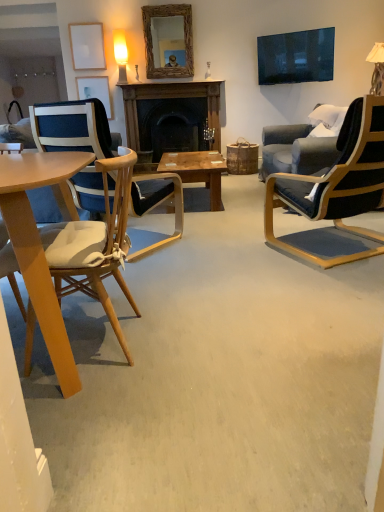
Question: From a real-world perspective, does dark wood fireplace at center stand above black leather chair at right, acting as the third chair starting from the left?

Choices:
 (A) yes
 (B) no

Answer: (A)

Question: From the image's perspective, is dark wood fireplace at center beneath black leather chair at right, marked as the first chair in a right-to-left arrangement?

Choices:
 (A) no
 (B) yes

Answer: (A)

Question: Does dark wood fireplace at center have a lesser height compared to black leather chair at right, acting as the third chair starting from the left?

Choices:
 (A) no
 (B) yes

Answer: (B)

Question: Is dark wood fireplace at center wider than black leather chair at right, marked as the first chair in a right-to-left arrangement?

Choices:
 (A) no
 (B) yes

Answer: (A)

Question: From the image's perspective, would you say dark wood fireplace at center is positioned over black leather chair at right, acting as the third chair starting from the left?

Choices:
 (A) yes
 (B) no

Answer: (A)

Question: In the image, is black leather chair at right, acting as the third chair starting from the left, on the left side or the right side of wooden coffee table at center?

Choices:
 (A) right
 (B) left

Answer: (A)

Question: Considering the positions of point (367, 114) and point (195, 176), is point (367, 114) closer or farther from the camera than point (195, 176)?

Choices:
 (A) closer
 (B) farther

Answer: (A)

Question: From a real-world perspective, is black leather chair at right, marked as the first chair in a right-to-left arrangement, positioned above or below wooden coffee table at center?

Choices:
 (A) above
 (B) below

Answer: (A)

Question: Considering the positions of black leather chair at right, acting as the third chair starting from the left, and wooden coffee table at center in the image, is black leather chair at right, acting as the third chair starting from the left, wider or thinner than wooden coffee table at center?

Choices:
 (A) thin
 (B) wide

Answer: (B)

Question: Would you say white fabric lampshade at upper right, which is the second lamp from left to right, is to the left or to the right of woven wood mirror at upper center in the picture?

Choices:
 (A) left
 (B) right

Answer: (B)

Question: From the image's perspective, relative to woven wood mirror at upper center, is white fabric lampshade at upper right, which is the second lamp from left to right, above or below?

Choices:
 (A) below
 (B) above

Answer: (A)

Question: Is point (369, 57) positioned closer to the camera than point (178, 76)?

Choices:
 (A) closer
 (B) farther

Answer: (A)

Question: In terms of width, does white fabric lampshade at upper right, the first lamp from the right, look wider or thinner when compared to woven wood mirror at upper center?

Choices:
 (A) thin
 (B) wide

Answer: (B)

Question: From the image's perspective, relative to matte yellow glass lamp at upper center, positioned as the 1th lamp in left-to-right order, is light brown wood chair at left, which is counted as the 2th chair, starting from the right, above or below?

Choices:
 (A) below
 (B) above

Answer: (A)

Question: Is point (61, 265) positioned closer to the camera than point (119, 38)?

Choices:
 (A) farther
 (B) closer

Answer: (B)